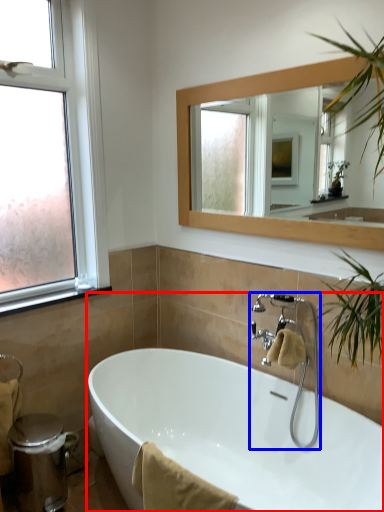
Question: Which object is further to the camera taking this photo, bathtub (highlighted by a red box) or tap (highlighted by a blue box)?

Choices:
 (A) bathtub
 (B) tap

Answer: (B)